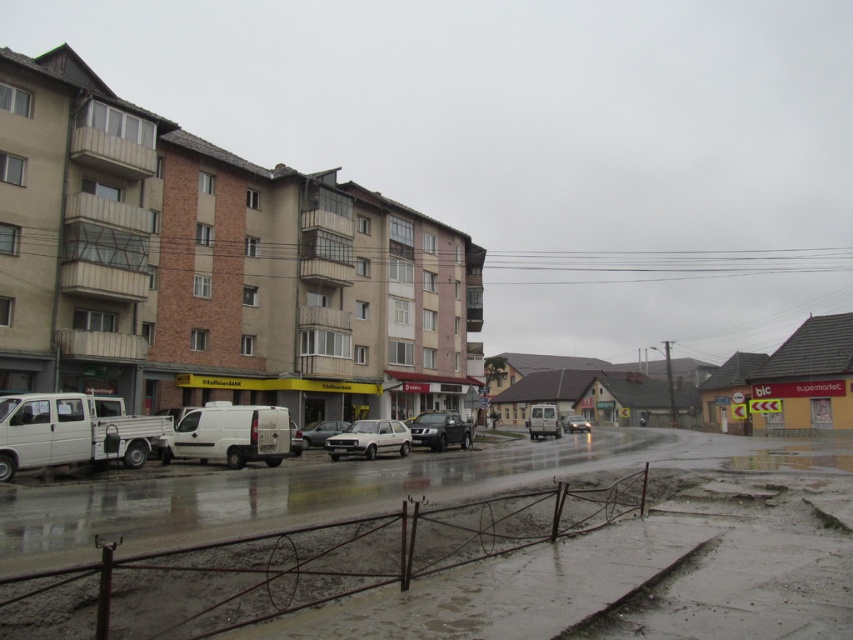
You are a delivery driver who needs to park your vehicle between two other cars. You see a white matte van at center and a silver metallic sedan at center. Which vehicle should you avoid choosing if you want to park in a narrow space that can only accommodate a smaller vehicle?

The white matte van at center has a lesser width compared to the silver metallic sedan at center, so you should avoid choosing the silver metallic sedan at center because it is wider and may not fit in the narrow space.

You are a delivery driver who needs to park your truck between the white matte van at center and the white matte hatchback at center. Your truck is 6 meters long. Is there enough space between them to park your truck?

The distance between the white matte van at center and the white matte hatchback at center is 5.93 meters. Since your truck is 6 meters long, there is not enough space to park between them.